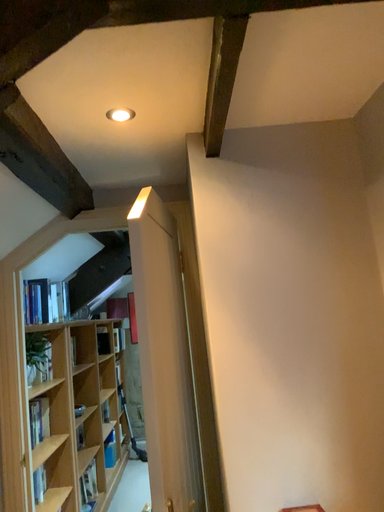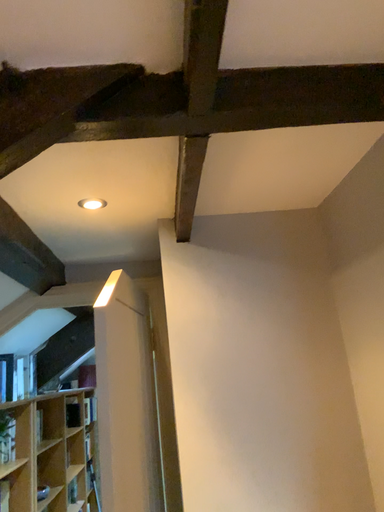
Question: How did the camera likely rotate when shooting the video?

Choices:
 (A) rotated downward
 (B) rotated upward

Answer: (B)